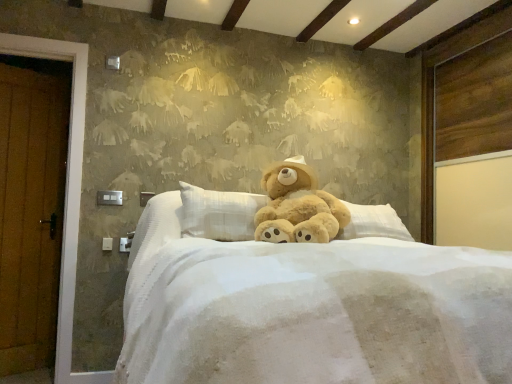
Locate an element on the screen. soft white fabric bed at center is located at coordinates (311, 309).

Image resolution: width=512 pixels, height=384 pixels. What do you see at coordinates (311, 309) in the screenshot?
I see `soft white fabric bed at center` at bounding box center [311, 309].

This screenshot has height=384, width=512. In order to click on fuzzy beige teddy bear at center in this screenshot , I will do click(298, 206).

The width and height of the screenshot is (512, 384). What do you see at coordinates (298, 206) in the screenshot?
I see `fuzzy beige teddy bear at center` at bounding box center [298, 206].

What are the coordinates of `soft white fabric bed at center` in the screenshot? It's located at 311,309.

Based on their positions, is fuzzy beige teddy bear at center located to the left or right of soft white fabric bed at center?

In the image, fuzzy beige teddy bear at center appears on the left side of soft white fabric bed at center.

Considering the positions of objects fuzzy beige teddy bear at center and soft white fabric bed at center in the image provided, who is behind, fuzzy beige teddy bear at center or soft white fabric bed at center?

Positioned behind is fuzzy beige teddy bear at center.

Is point (291, 211) farther from camera compared to point (436, 275)?

Yes, it is behind point (436, 275).

From the image's perspective, does fuzzy beige teddy bear at center appear lower than soft white fabric bed at center?

No.

From a real-world perspective, which object rests below the other?

In real-world perspective, soft white fabric bed at center is lower.

Does fuzzy beige teddy bear at center have a lesser width compared to soft white fabric bed at center?

Correct, the width of fuzzy beige teddy bear at center is less than that of soft white fabric bed at center.

Is fuzzy beige teddy bear at center taller than soft white fabric bed at center?

No.

Considering the sizes of objects fuzzy beige teddy bear at center and soft white fabric bed at center in the image provided, who is bigger, fuzzy beige teddy bear at center or soft white fabric bed at center?

soft white fabric bed at center.

Choose the correct answer: Is fuzzy beige teddy bear at center inside soft white fabric bed at center or outside it?

fuzzy beige teddy bear at center is inside soft white fabric bed at center.

Is fuzzy beige teddy bear at center directly adjacent to soft white fabric bed at center?

fuzzy beige teddy bear at center and soft white fabric bed at center are clearly separated.

Is fuzzy beige teddy bear at center turned away from soft white fabric bed at center?

Absolutely, fuzzy beige teddy bear at center is directed away from soft white fabric bed at center.

Can you tell me how much fuzzy beige teddy bear at center and soft white fabric bed at center differ in facing direction?

23.3 degrees.

What are the coordinates of `bed that is on the right side of fuzzy beige teddy bear at center` in the screenshot? It's located at (311, 309).

Can you confirm if soft white fabric bed at center is positioned to the right of fuzzy beige teddy bear at center?

Yes, soft white fabric bed at center is to the right of fuzzy beige teddy bear at center.

Is the position of soft white fabric bed at center more distant than that of fuzzy beige teddy bear at center?

No, soft white fabric bed at center is in front of fuzzy beige teddy bear at center.

Between point (410, 271) and point (320, 209), which one is positioned in front?

The point (410, 271) is closer to the camera.

From the picture: From the image's perspective, who appears lower, soft white fabric bed at center or fuzzy beige teddy bear at center?

From the image's view, soft white fabric bed at center is below.

From a real-world perspective, is soft white fabric bed at center below fuzzy beige teddy bear at center?

Yes, from a real-world perspective, soft white fabric bed at center is under fuzzy beige teddy bear at center.

From the picture: Can you confirm if soft white fabric bed at center is wider than fuzzy beige teddy bear at center?

Yes.

Can you confirm if soft white fabric bed at center is taller than fuzzy beige teddy bear at center?

Correct, soft white fabric bed at center is much taller as fuzzy beige teddy bear at center.

Is soft white fabric bed at center bigger than fuzzy beige teddy bear at center?

Correct, soft white fabric bed at center is larger in size than fuzzy beige teddy bear at center.

Is soft white fabric bed at center not within fuzzy beige teddy bear at center?

soft white fabric bed at center is positioned outside fuzzy beige teddy bear at center.

Is soft white fabric bed at center far from fuzzy beige teddy bear at center?

That's not correct — soft white fabric bed at center is a little close to fuzzy beige teddy bear at center.

Could you tell me if soft white fabric bed at center is turned towards fuzzy beige teddy bear at center?

No, soft white fabric bed at center is not turned towards fuzzy beige teddy bear at center.

Can you tell me how much soft white fabric bed at center and fuzzy beige teddy bear at center differ in facing direction?

23.3 degrees separate the facing orientations of soft white fabric bed at center and fuzzy beige teddy bear at center.

How much distance is there between soft white fabric bed at center and fuzzy beige teddy bear at center?

They are 26.92 inches apart.

At what (x,y) coordinates should I click in order to perform the action: click on bed below the fuzzy beige teddy bear at center (from the image's perspective). Please return your answer as a coordinate pair (x, y). Looking at the image, I should click on (311, 309).

Identify the location of bed below the fuzzy beige teddy bear at center (from a real-world perspective). This screenshot has width=512, height=384. (311, 309).

Identify the location of teddy bear that appears above the soft white fabric bed at center (from the image's perspective). This screenshot has height=384, width=512. (298, 206).